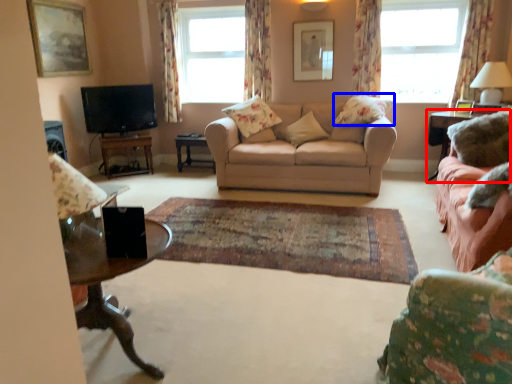
Question: Which object is further to the camera taking this photo, table (highlighted by a red box) or pillow (highlighted by a blue box)?

Choices:
 (A) table
 (B) pillow

Answer: (B)